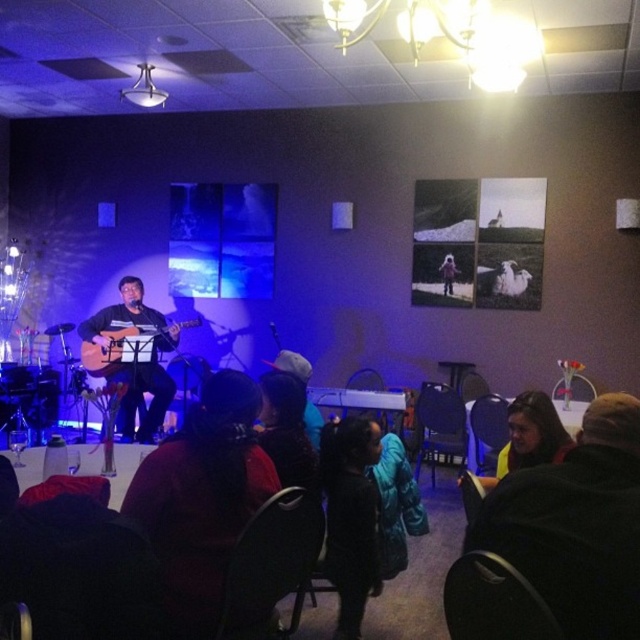
Who is higher up, matte black guitar at center or matte black guitar at left?

matte black guitar at left

In the scene shown: Is matte black guitar at center positioned at the back of matte black guitar at left?

No, it is not.

The height and width of the screenshot is (640, 640). In order to click on matte black guitar at center in this screenshot , I will do `click(138, 364)`.

The height and width of the screenshot is (640, 640). Find the location of `matte black guitar at center`. matte black guitar at center is located at coordinates (138, 364).